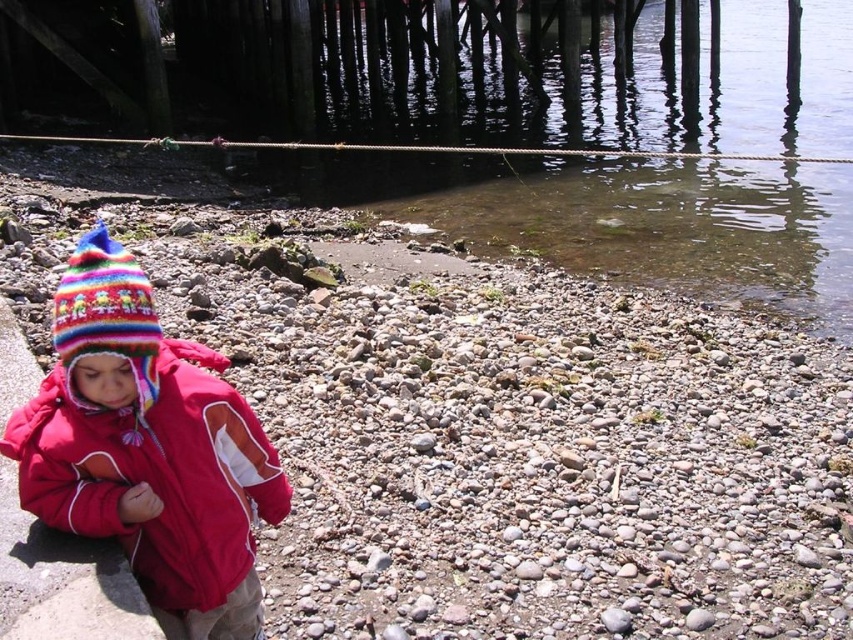
You are a parent trying to keep your child safe while they play near the water. You notice the knitted woolen hat at lower left and the red fabric curb at lower left. Which object is closer to the water?

The knitted woolen hat at lower left is 12.84 inches away from the red fabric curb at lower left, but the question is about proximity to the water. Since both objects are at lower left, their distance from each other doesn not indicate their distance from the water. The scene description mentions the child is on a paved path bordering the rocky shore, so the red fabric curb likely marks the edge near water. Thus, the red fabric curb at lower left is closer to the water.

You are standing on the paved path and want to reach the clear water at lower center. What direction should you move in to get there?

The clear water at lower center is located at coordinates point (639, 220), so you should move towards the lower center direction to reach it.

You are a photographer trying to capture the child in the scene. You want to ensure that both the red fabric curb at lower left and the multicolored knitted hat at left are in the same frame. Given their distance apart, is this possible with a standard camera lens?

The red fabric curb at lower left and multicolored knitted hat at left are 20.63 inches apart from each other. A standard camera lens has a field of view wide enough to capture objects 20.63 inches apart in the same frame, so yes, it is possible.